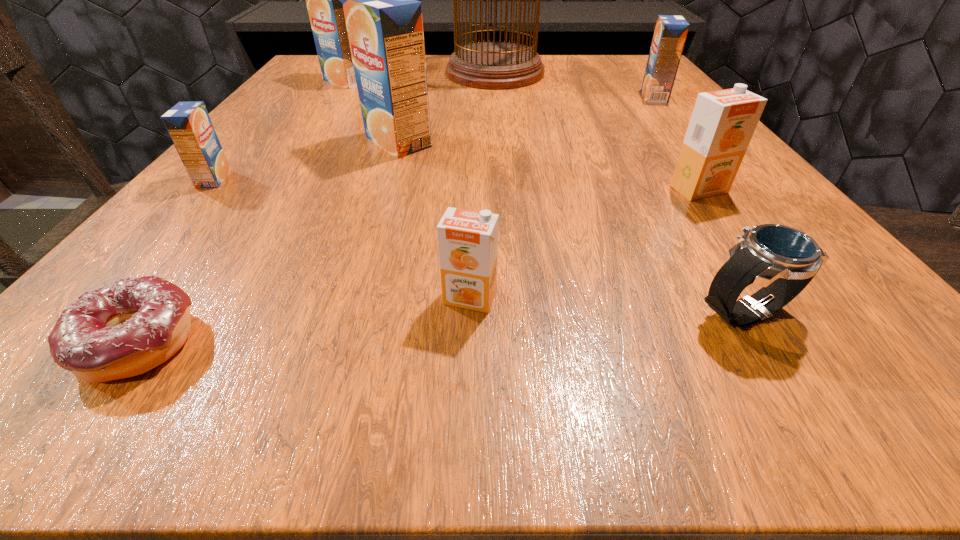
Locate an element on the screen. This screenshot has width=960, height=540. the tallest object is located at coordinates (493, 65).

Where is `the second tallest object`? Image resolution: width=960 pixels, height=540 pixels. the second tallest object is located at coordinates (384, 23).

This screenshot has width=960, height=540. What are the coordinates of `the tallest orange juice` in the screenshot? It's located at (384, 23).

Find the location of a particular element. The height and width of the screenshot is (540, 960). the farthest orange juice is located at coordinates (324, 0).

You are a GUI agent. You are given a task and a screenshot of the screen. Output one action in this format:
    pyautogui.click(x=<x>, y=<y>)
    Task: Click on the fifth orange juice from right to left
    The width and height of the screenshot is (960, 540).
    Given the screenshot: What is the action you would take?
    pyautogui.click(x=324, y=0)

What are the coordinates of `the rightmost blue orange_juice` in the screenshot? It's located at (670, 33).

Where is `the fifth nearest orange juice`? This screenshot has width=960, height=540. the fifth nearest orange juice is located at coordinates (670, 33).

Find the location of `the right orange orange juice`. the right orange orange juice is located at coordinates (723, 122).

Locate an element on the screen. Image resolution: width=960 pixels, height=540 pixels. the farther orange orange juice is located at coordinates (723, 122).

Identify the location of the leftmost blue orange_juice. (189, 125).